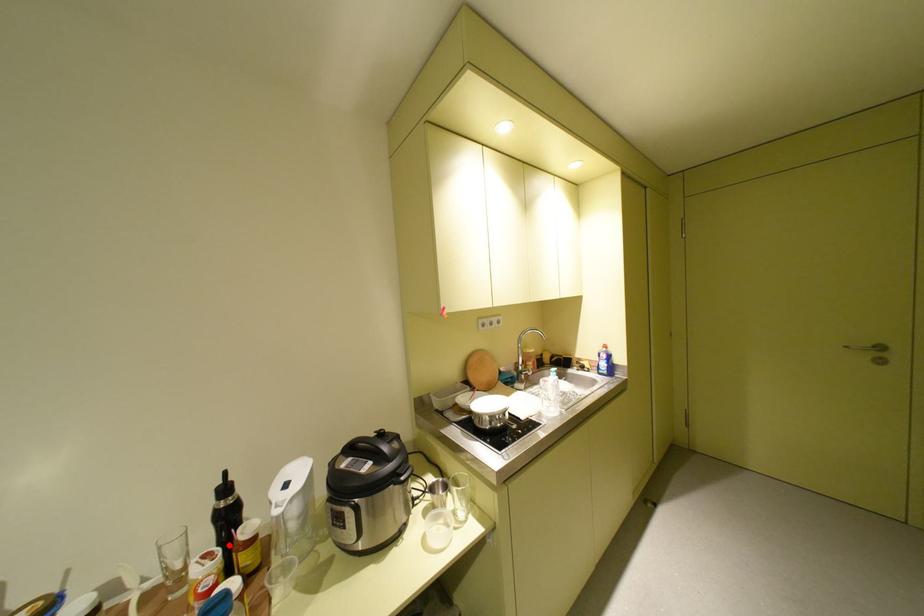
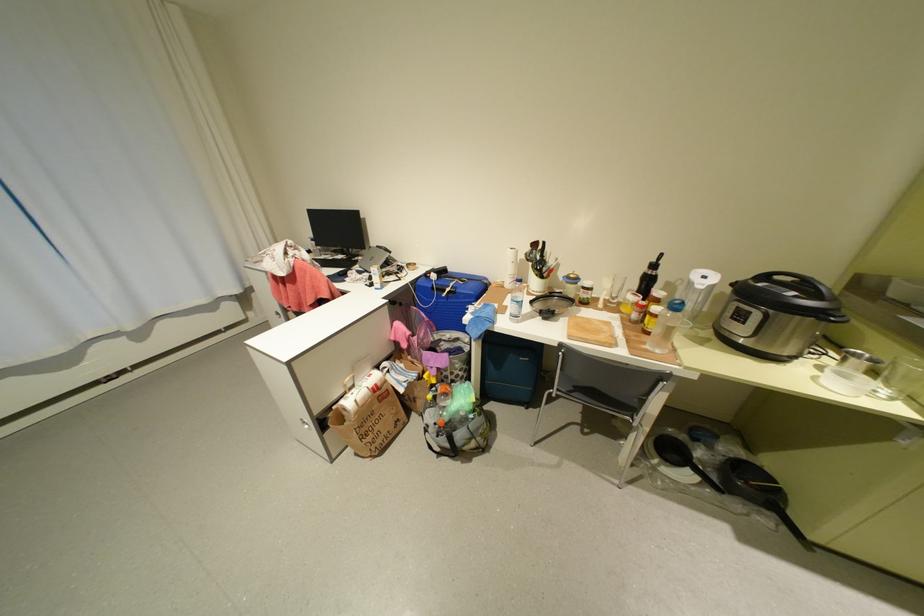
Where in the second image is the point corresponding to the highlighted location from the first image?

(649, 294)